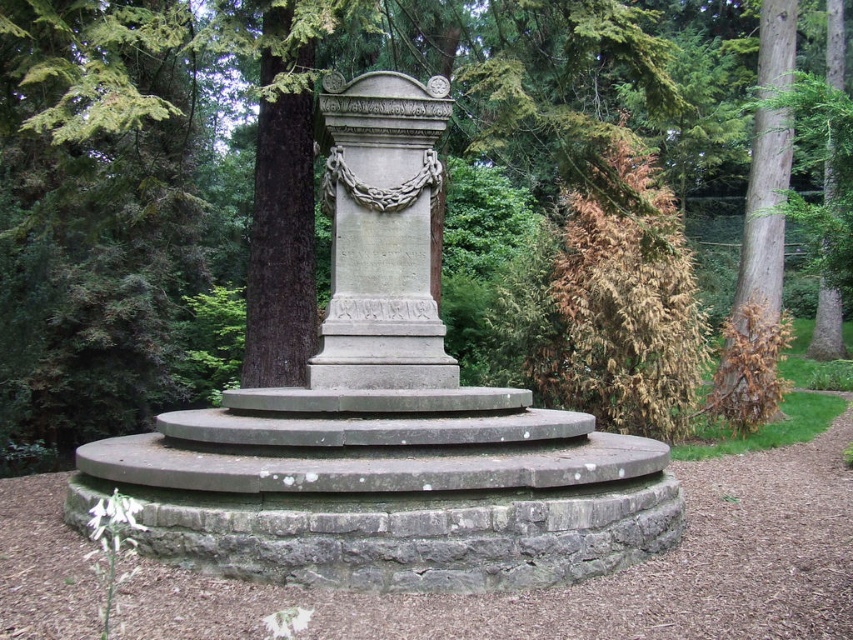
Based on the photo, which of these two, green textured tree at center or brown rough bark tree at right, stands taller?

green textured tree at center is taller.

Between green textured tree at center and brown rough bark tree at right, which one is positioned higher?

Positioned higher is brown rough bark tree at right.

Is point (107, 396) behind point (746, 193)?

No.

At what (x,y) coordinates should I click in order to perform the action: click on green textured tree at center. Please return your answer as a coordinate pair (x, y). Looking at the image, I should click on (329, 220).

What do you see at coordinates (381, 234) in the screenshot? Image resolution: width=853 pixels, height=640 pixels. I see `gray stone monument at center` at bounding box center [381, 234].

Is point (334, 307) farther from viewer compared to point (734, 301)?

No.

Which is behind, point (413, 108) or point (764, 400)?

The point (764, 400) is behind.

Locate an element on the screen. gray stone monument at center is located at coordinates (381, 234).

Consider the image. Is green textured tree at center wider than gray stone monument at center?

Correct, the width of green textured tree at center exceeds that of gray stone monument at center.

The height and width of the screenshot is (640, 853). Identify the location of green textured tree at center. (329, 220).

Where is `green textured tree at center`? green textured tree at center is located at coordinates (329, 220).